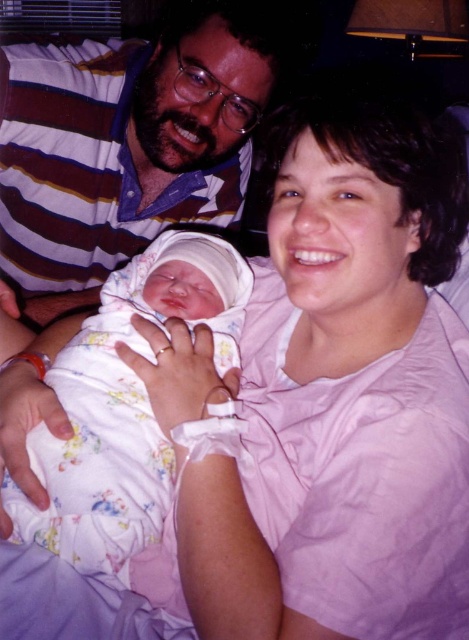
Is matte striped shirt at upper left to the right of floral cotton swaddle at center from the viewer's perspective?

No, matte striped shirt at upper left is not to the right of floral cotton swaddle at center.

Can you confirm if matte striped shirt at upper left is shorter than floral cotton swaddle at center?

No.

You are a GUI agent. You are given a task and a screenshot of the screen. Output one action in this format:
    pyautogui.click(x=<x>, y=<y>)
    Task: Click on the matte striped shirt at upper left
    The height and width of the screenshot is (640, 469).
    Given the screenshot: What is the action you would take?
    pyautogui.click(x=127, y=145)

What are the coordinates of `matte striped shirt at upper left` in the screenshot? It's located at (127, 145).